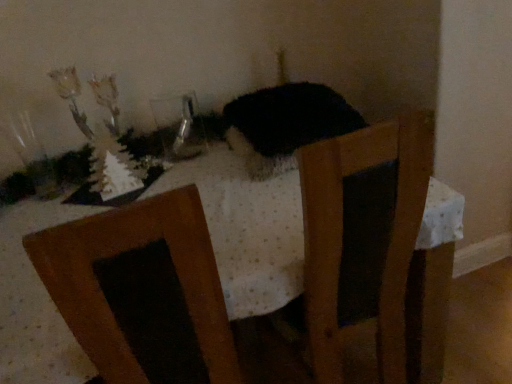
Locate an element on the screen. The width and height of the screenshot is (512, 384). white dotted fabric at center is located at coordinates (250, 233).

Locate an element on the screen. This screenshot has width=512, height=384. animal that is behind the white dotted fabric at center is located at coordinates (284, 124).

How far apart are fuzzy black cat at center and white dotted fabric at center?

A distance of 7.66 inches exists between fuzzy black cat at center and white dotted fabric at center.

Is fuzzy black cat at center in contact with white dotted fabric at center?

No, fuzzy black cat at center is not in contact with white dotted fabric at center.

Can you see fuzzy black cat at center touching transparent glass vase at upper left?

No, fuzzy black cat at center is not next to transparent glass vase at upper left.

Does fuzzy black cat at center come in front of transparent glass vase at upper left?

Yes, the depth of fuzzy black cat at center is less than that of transparent glass vase at upper left.

Consider the image. Could you tell me if fuzzy black cat at center is facing transparent glass vase at upper left?

No.

How distant is fuzzy black cat at center from transparent glass vase at upper left?

fuzzy black cat at center and transparent glass vase at upper left are 12.33 inches apart.

Is white dotted fabric at center situated inside fuzzy black cat at center or outside?

white dotted fabric at center is not enclosed by fuzzy black cat at center.

Which of these two, white dotted fabric at center or fuzzy black cat at center, is thinner?

fuzzy black cat at center is thinner.

Which is in front, white dotted fabric at center or fuzzy black cat at center?

white dotted fabric at center is more forward.

How different are the orientations of transparent glass vase at upper left and white dotted fabric at center in degrees?

6.44 degrees.

In the scene shown: Could you tell me if transparent glass vase at upper left is turned towards white dotted fabric at center?

No, transparent glass vase at upper left is not aimed at white dotted fabric at center.

From the image's perspective, is transparent glass vase at upper left located above or below white dotted fabric at center?

Based on their image positions, transparent glass vase at upper left is located above white dotted fabric at center.

Which object is closer to the camera, transparent glass vase at upper left or white dotted fabric at center?

white dotted fabric at center is closer to the camera.

Is fuzzy black cat at center located within transparent glass vase at upper left?

No, fuzzy black cat at center is not a part of transparent glass vase at upper left.

From the image's perspective, is transparent glass vase at upper left above fuzzy black cat at center?

No, from the image's perspective, transparent glass vase at upper left is not above fuzzy black cat at center.

Is point (169, 150) closer or farther from the camera than point (245, 166)?

Point (169, 150).

Where is `glass vase below the fuzzy black cat at center (from the image's perspective)`? The image size is (512, 384). glass vase below the fuzzy black cat at center (from the image's perspective) is located at coordinates (179, 127).

Does white dotted fabric at center turn towards transparent glass vase at upper left?

No, white dotted fabric at center is not oriented towards transparent glass vase at upper left.

Who is smaller, white dotted fabric at center or transparent glass vase at upper left?

transparent glass vase at upper left is smaller.

From the image's perspective, is white dotted fabric at center above or below transparent glass vase at upper left?

From the image's perspective, white dotted fabric at center appears below transparent glass vase at upper left.

Is white dotted fabric at center far away from transparent glass vase at upper left?

white dotted fabric at center is actually quite close to transparent glass vase at upper left.

The height and width of the screenshot is (384, 512). Find the location of `table directly beneath the fuzzy black cat at center (from a real-world perspective)`. table directly beneath the fuzzy black cat at center (from a real-world perspective) is located at coordinates (250, 233).

At what (x,y) coordinates should I click in order to perform the action: click on animal on the right of transparent glass vase at upper left. Please return your answer as a coordinate pair (x, y). Looking at the image, I should click on (284, 124).

From the picture: Which object lies further to the anchor point transparent glass vase at upper left, white dotted fabric at center or fuzzy black cat at center?

fuzzy black cat at center.

Which object lies further to the anchor point transparent glass vase at upper left, fuzzy black cat at center or white dotted fabric at center?

fuzzy black cat at center.

Based on their spatial positions, is transparent glass vase at upper left or white dotted fabric at center closer to fuzzy black cat at center?

The object closer to fuzzy black cat at center is white dotted fabric at center.

From the image, which object appears to be nearer to fuzzy black cat at center, white dotted fabric at center or transparent glass vase at upper left?

The object closer to fuzzy black cat at center is white dotted fabric at center.

Considering their positions, is fuzzy black cat at center positioned further to white dotted fabric at center than transparent glass vase at upper left?

Based on the image, transparent glass vase at upper left appears to be further to white dotted fabric at center.

Considering their positions, is transparent glass vase at upper left positioned closer to white dotted fabric at center than fuzzy black cat at center?

The object closer to white dotted fabric at center is fuzzy black cat at center.

Locate an element on the screen. The height and width of the screenshot is (384, 512). animal between white dotted fabric at center and transparent glass vase at upper left in the front-back direction is located at coordinates (284, 124).